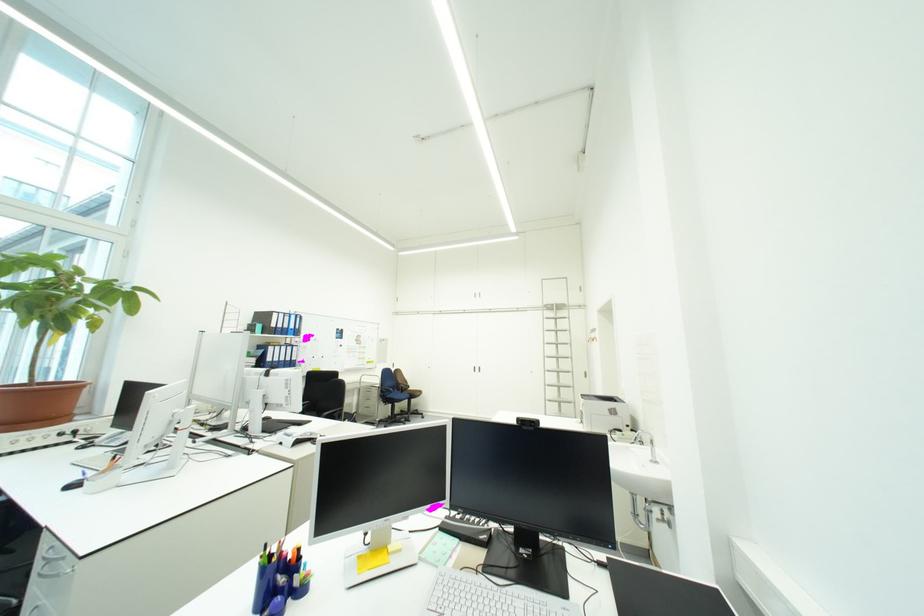
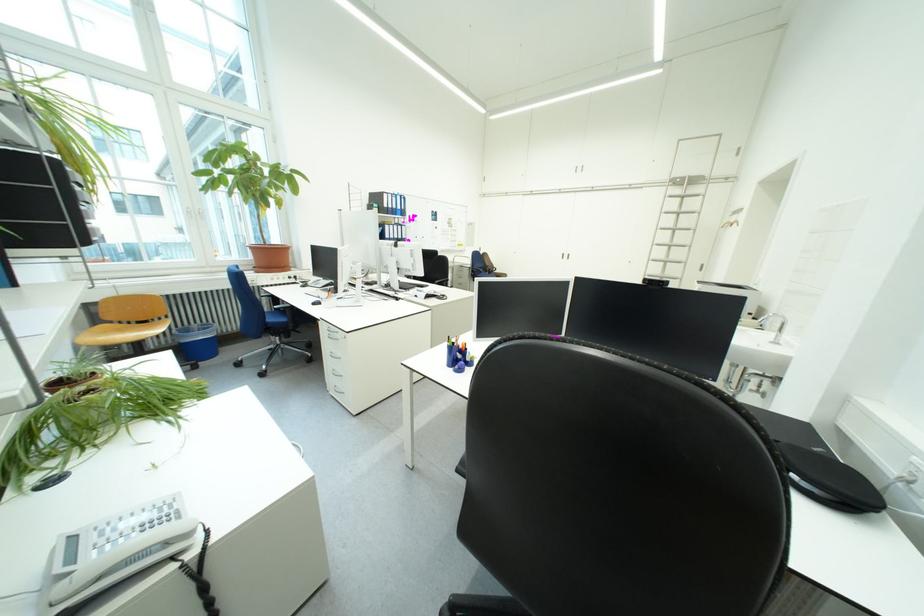
Where in the second image is the point corresponding to the point at 286,361 from the first image?

(403, 238)